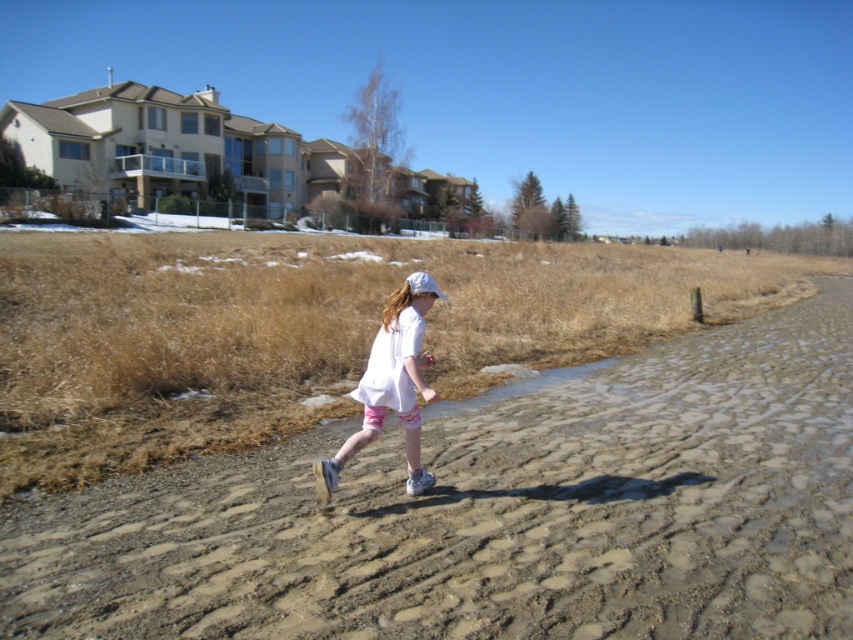
Question: Does brown textured dirt track at center come in front of white cotton shirt at center?

Choices:
 (A) no
 (B) yes

Answer: (B)

Question: Can you confirm if brown textured dirt track at center is positioned to the left of white cotton shirt at center?

Choices:
 (A) no
 (B) yes

Answer: (A)

Question: Which of the following is the farthest from the observer?

Choices:
 (A) white cotton shirt at center
 (B) brown textured dirt track at center

Answer: (A)

Question: From the image, what is the correct spatial relationship of brown textured dirt track at center in relation to white cotton shirt at center?

Choices:
 (A) above
 (B) below

Answer: (B)

Question: Which point is farther to the camera?

Choices:
 (A) [598, 579]
 (B) [387, 358]

Answer: (B)